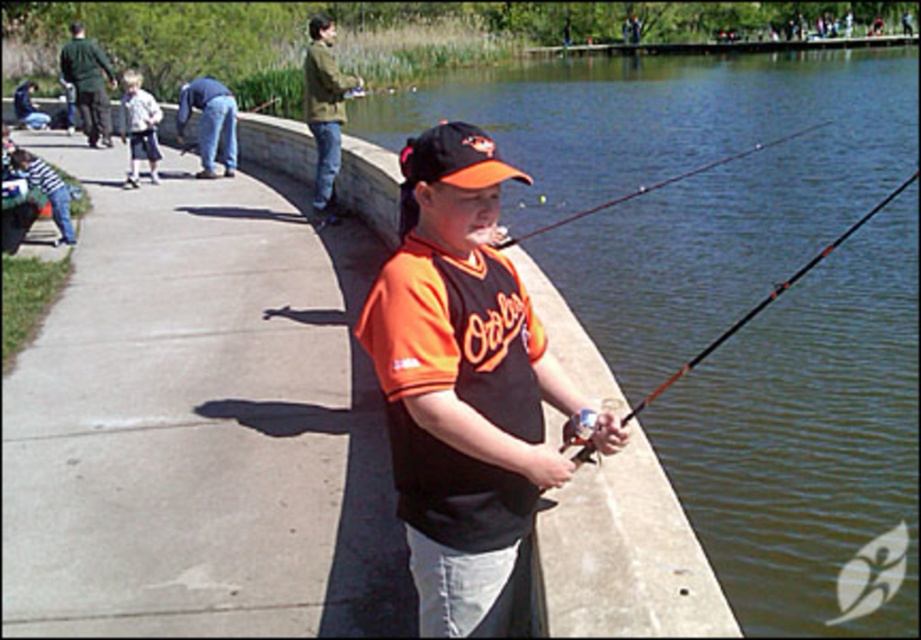
Can you confirm if green water at fishing rod right is shorter than black matte fishing pole at center?

No, green water at fishing rod right is not shorter than black matte fishing pole at center.

Can you confirm if green water at fishing rod right is positioned above black matte fishing pole at center?

Yes, green water at fishing rod right is above black matte fishing pole at center.

Is point (579, 97) closer to camera compared to point (585, 449)?

No, it is behind (585, 449).

Where is `green water at fishing rod right`? The width and height of the screenshot is (921, 640). green water at fishing rod right is located at coordinates (675, 172).

Who is more distant from viewer, (x=498, y=483) or (x=694, y=364)?

The point (x=694, y=364) is behind.

Which is in front, point (417, 200) or point (811, 268)?

Point (417, 200) is in front.

Describe the element at coordinates (465, 387) in the screenshot. The width and height of the screenshot is (921, 640). I see `orange jersey at center` at that location.

Image resolution: width=921 pixels, height=640 pixels. What are the coordinates of `orange jersey at center` in the screenshot? It's located at (465, 387).

At what (x,y) coordinates should I click in order to perform the action: click on orange jersey at center. Please return your answer as a coordinate pair (x, y). The width and height of the screenshot is (921, 640). Looking at the image, I should click on (465, 387).

Does orange jersey at center have a lesser width compared to light blue shorts at left?

Yes, orange jersey at center is thinner than light blue shorts at left.

Where is `orange jersey at center`? Image resolution: width=921 pixels, height=640 pixels. orange jersey at center is located at coordinates (465, 387).